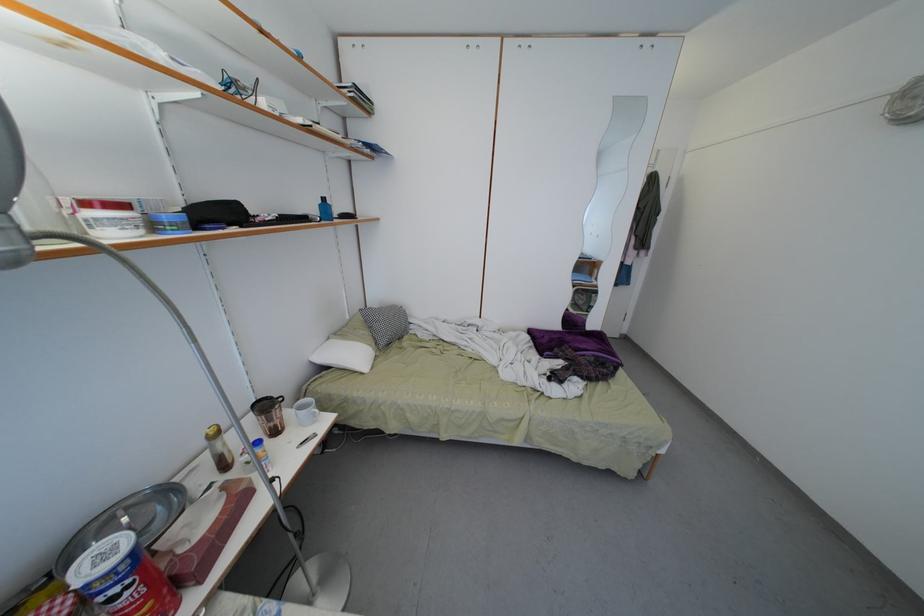
Find where to lift the silver metal bowl. Please return your answer as a coordinate pair (x, y).

(128, 521)